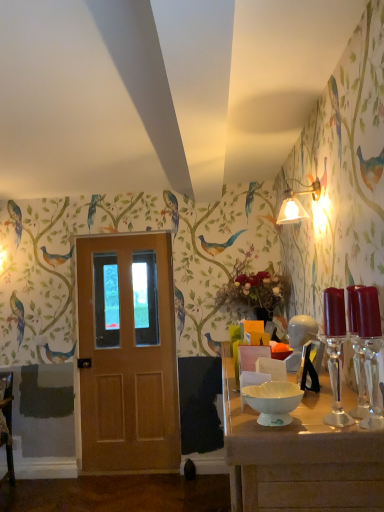
Question: Can you see wooden door at center touching white glossy bowl at center?

Choices:
 (A) yes
 (B) no

Answer: (B)

Question: Could you tell me if wooden door at center is turned towards white glossy bowl at center?

Choices:
 (A) no
 (B) yes

Answer: (A)

Question: Is wooden door at center wider than white glossy bowl at center?

Choices:
 (A) yes
 (B) no

Answer: (B)

Question: Is wooden door at center outside white glossy bowl at center?

Choices:
 (A) no
 (B) yes

Answer: (B)

Question: Does wooden door at center have a greater height compared to white glossy bowl at center?

Choices:
 (A) no
 (B) yes

Answer: (B)

Question: Is wooden door at center positioned behind white glossy bowl at center?

Choices:
 (A) no
 (B) yes

Answer: (B)

Question: Is white glossy table at lower right at the left side of white glossy bowl at center?

Choices:
 (A) yes
 (B) no

Answer: (B)

Question: From a real-world perspective, does white glossy table at lower right stand above white glossy bowl at center?

Choices:
 (A) yes
 (B) no

Answer: (B)

Question: From a real-world perspective, is white glossy table at lower right located beneath white glossy bowl at center?

Choices:
 (A) no
 (B) yes

Answer: (B)

Question: Can you confirm if white glossy table at lower right is shorter than white glossy bowl at center?

Choices:
 (A) no
 (B) yes

Answer: (A)

Question: Is white glossy table at lower right in front of white glossy bowl at center?

Choices:
 (A) yes
 (B) no

Answer: (A)

Question: Does white glossy table at lower right appear on the right side of white glossy bowl at center?

Choices:
 (A) yes
 (B) no

Answer: (A)

Question: Does matte white lampshade at upper right have a larger size compared to white glossy table at lower right?

Choices:
 (A) no
 (B) yes

Answer: (A)